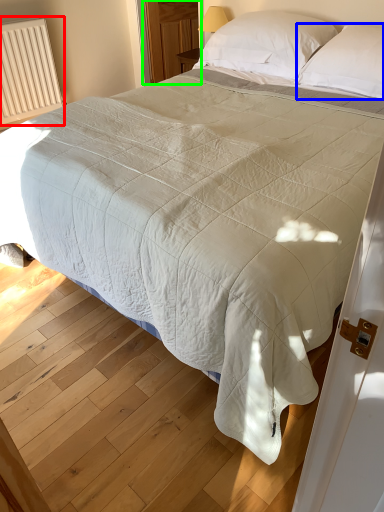
Question: Considering the real-world distances, which object is farthest from radiator (highlighted by a red box)? pillow (highlighted by a blue box) or glass door (highlighted by a green box)?

Choices:
 (A) pillow
 (B) glass door

Answer: (A)